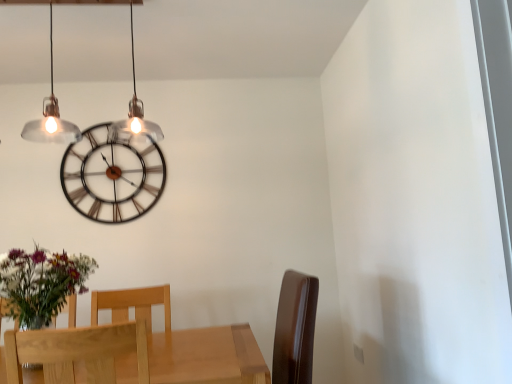
Question: Can metallic wire clock at upper center be found inside light wood chair at lower left, positioned as the 2th chair in front-to-back order?

Choices:
 (A) no
 (B) yes

Answer: (A)

Question: Is light wood chair at lower left, the first chair in the back-to-front sequence, completely or partially outside of metallic wire clock at upper center?

Choices:
 (A) yes
 (B) no

Answer: (A)

Question: Is the position of light wood chair at lower left, the first chair in the back-to-front sequence, more distant than that of metallic wire clock at upper center?

Choices:
 (A) no
 (B) yes

Answer: (A)

Question: Does light wood chair at lower left, positioned as the 2th chair in front-to-back order, have a larger size compared to metallic wire clock at upper center?

Choices:
 (A) no
 (B) yes

Answer: (B)

Question: Would you consider light wood chair at lower left, positioned as the 2th chair in front-to-back order, to be distant from metallic wire clock at upper center?

Choices:
 (A) yes
 (B) no

Answer: (B)

Question: Looking at their shapes, would you say metallic wire clock at upper center is wider or thinner than light brown wood chair at lower left, acting as the first chair starting from the front?

Choices:
 (A) wide
 (B) thin

Answer: (B)

Question: From the image's perspective, is metallic wire clock at upper center above or below light brown wood chair at lower left, the 2th chair in the back-to-front sequence?

Choices:
 (A) below
 (B) above

Answer: (B)

Question: Relative to light brown wood chair at lower left, acting as the first chair starting from the front, is metallic wire clock at upper center in front or behind?

Choices:
 (A) front
 (B) behind

Answer: (B)

Question: From a real-world perspective, is metallic wire clock at upper center above or below light brown wood chair at lower left, the 2th chair in the back-to-front sequence?

Choices:
 (A) below
 (B) above

Answer: (B)

Question: From a real-world perspective, relative to clear glass pendant lights at upper left, is light wood chair at lower left, positioned as the 2th chair in front-to-back order, vertically above or below?

Choices:
 (A) above
 (B) below

Answer: (B)

Question: Is light wood chair at lower left, positioned as the 2th chair in front-to-back order, taller or shorter than clear glass pendant lights at upper left?

Choices:
 (A) tall
 (B) short

Answer: (B)

Question: In terms of size, does light wood chair at lower left, the first chair in the back-to-front sequence, appear bigger or smaller than clear glass pendant lights at upper left?

Choices:
 (A) big
 (B) small

Answer: (B)

Question: Do you think light wood chair at lower left, positioned as the 2th chair in front-to-back order, is within clear glass pendant lights at upper left, or outside of it?

Choices:
 (A) inside
 (B) outside

Answer: (B)

Question: In terms of width, does metallic wire clock at upper center look wider or thinner when compared to light wood chair at lower left, positioned as the 2th chair in front-to-back order?

Choices:
 (A) thin
 (B) wide

Answer: (A)

Question: Choose the correct answer: Is metallic wire clock at upper center inside light wood chair at lower left, positioned as the 2th chair in front-to-back order, or outside it?

Choices:
 (A) inside
 (B) outside

Answer: (B)